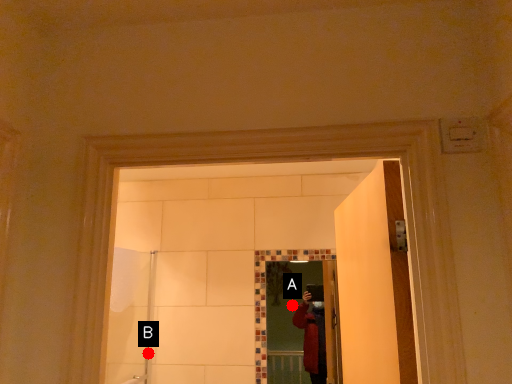
Question: Two points are circled on the image, labeled by A and B beside each circle. Which point is closer to the camera taking this photo?

Choices:
 (A) A is closer
 (B) B is closer

Answer: (A)